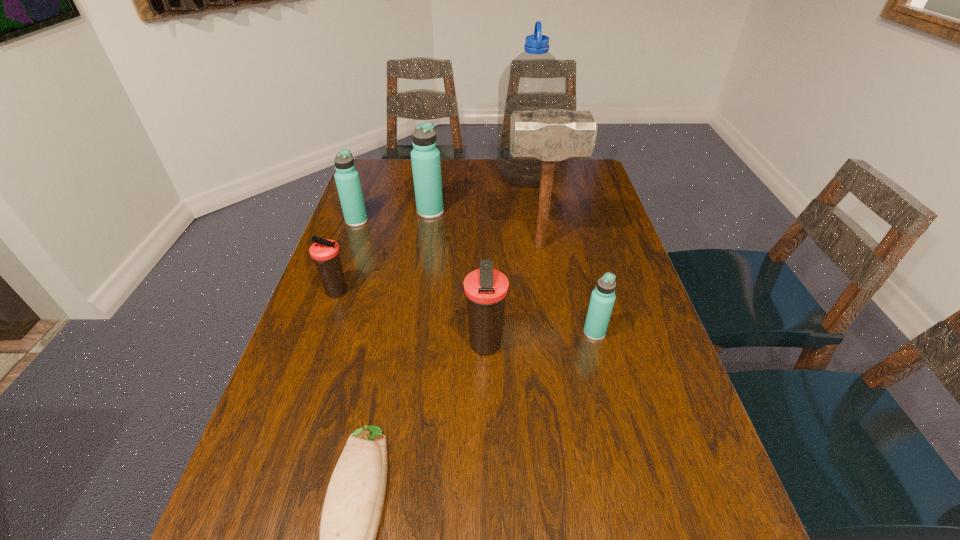
This screenshot has height=540, width=960. In order to click on the third farthest thermos bottle in this screenshot , I will do `click(325, 253)`.

Locate an element on the screen. the rightmost aqua thermos bottle is located at coordinates pos(602,300).

The image size is (960, 540). Identify the location of the smallest aqua thermos bottle. (602, 300).

Find the location of `vacant area located 0.340m on the left of the farthest object`. vacant area located 0.340m on the left of the farthest object is located at coordinates tap(406, 176).

Locate an element on the screen. free spot located on the striking face of the fourth farthest object is located at coordinates (440, 246).

Where is `vacant space located on the striking face of the fourth farthest object`? The image size is (960, 540). vacant space located on the striking face of the fourth farthest object is located at coordinates (374, 246).

You are a GUI agent. You are given a task and a screenshot of the screen. Output one action in this format:
    pyautogui.click(x=<x>, y=<y>)
    Task: Click on the free point located on the striking face of the fourth farthest object
    This screenshot has height=540, width=960.
    Given the screenshot: What is the action you would take?
    pyautogui.click(x=380, y=246)

The image size is (960, 540). I want to click on free spot located on the front of the biggest aqua thermos bottle, so click(x=424, y=254).

What are the coordinates of `vacant space located on the front of the right brown thermos bottle` in the screenshot? It's located at (484, 497).

Locate an element on the screen. This screenshot has width=960, height=540. vacant space located 0.190m on the right of the leftmost aqua thermos bottle is located at coordinates (425, 221).